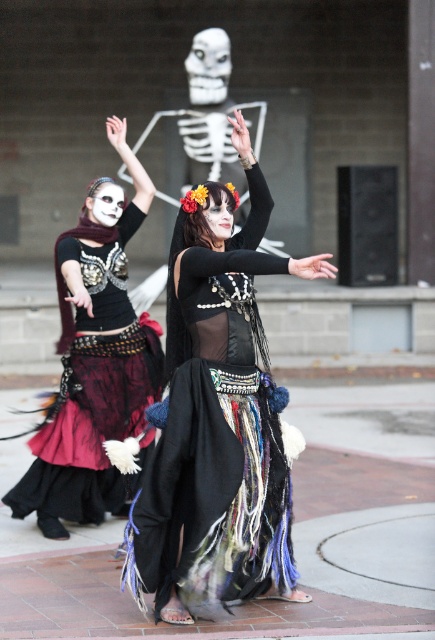
Looking at this image, you are a photographer trying to capture the black lace skirt at center in the image. The camera is set to focus on the point at coordinates (218, 419). Will the black lace skirt at center be in focus?

Yes, the point at coordinates (218, 419) indicates the black lace skirt at center, so the camera will focus on it.

You are standing in the plaza and want to take a photo of the black lace skirt at center. If your camera has a maximum focus range of 20 feet, will you be able to capture the skirt clearly?

The black lace skirt at center is 21.92 feet away from the viewer. Since the camera can only focus up to 20 feet, it won cannot capture the skirt clearly at this distance.

You are a photographer trying to capture the performers from above. Which of the two items, the black lace skirt at center or the matte black dress at center, would appear higher in the photo?

The matte black dress at center appears higher in the photo because it is located above the black lace skirt at center.